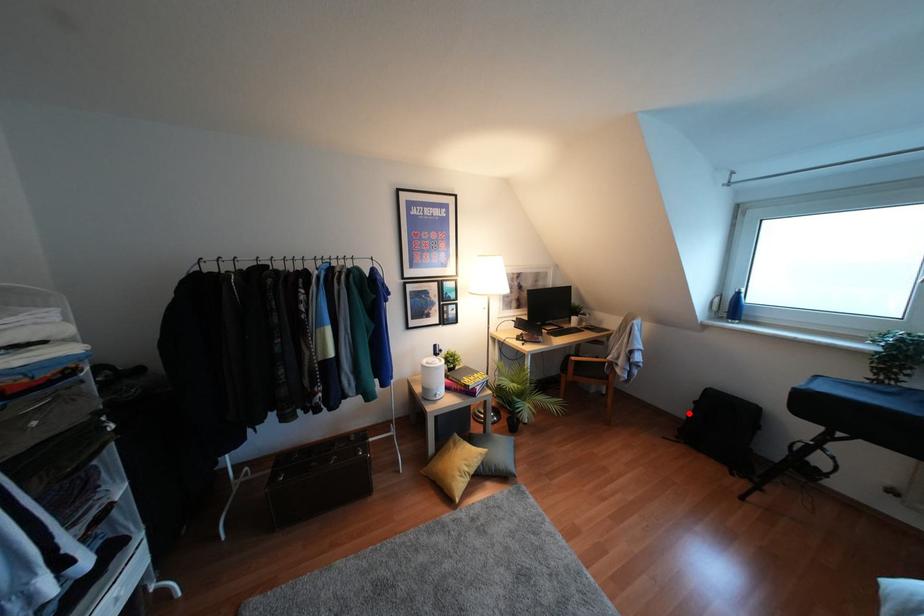
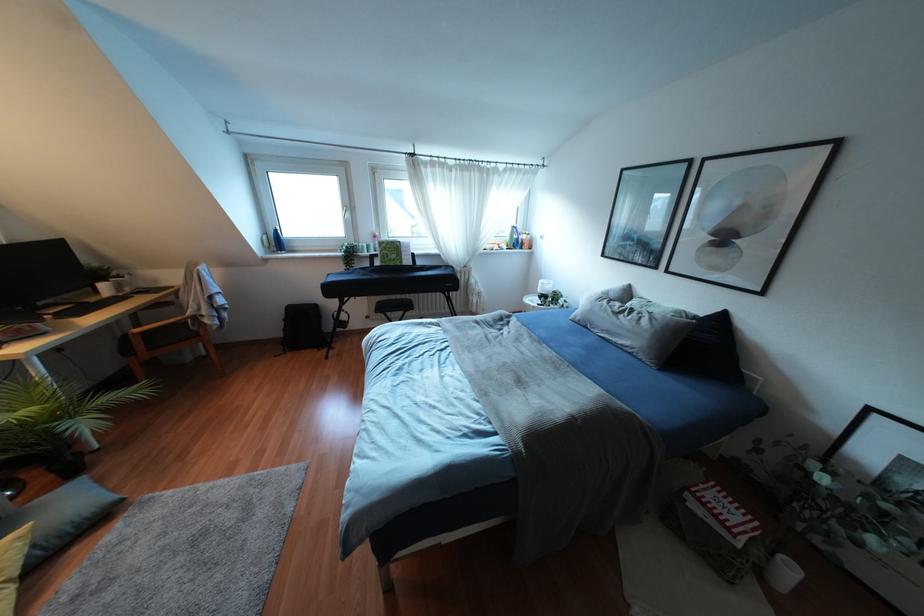
Question: I am providing you with two images of the same scene from different viewpoints. A red point is shown in image1. For the corresponding object point in image2, is it positioned nearer or farther from the camera?

Choices:
 (A) Nearer
 (B) Farther

Answer: (B)